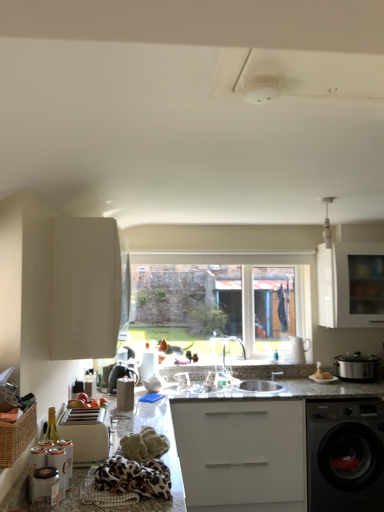
Measure the distance between point (22, 490) and camera.

Point (22, 490) is 5.00 feet away from camera.

This screenshot has height=512, width=384. Describe the element at coordinates (161, 459) in the screenshot. I see `granite countertop at lower left, the second countertop positioned from the right` at that location.

Describe the element at coordinates (88, 288) in the screenshot. I see `white glossy cabinet at upper left, the 2th cabinetry viewed from the back` at that location.

This screenshot has height=512, width=384. What do you see at coordinates (351, 285) in the screenshot?
I see `white glossy cabinet at upper right, the second cabinetry in the front-to-back sequence` at bounding box center [351, 285].

This screenshot has height=512, width=384. I want to click on white glossy countertop at lower left, the second countertop in the left-to-right sequence, so click(262, 446).

Locate an element on the screen. Image resolution: width=384 pixels, height=512 pixels. black metallic washing machine at lower right is located at coordinates (345, 455).

Find the location of a particular element. The image size is (384, 512). granite countertop at lower left, the first countertop from the left is located at coordinates (161, 459).

Is granite countertop at lower left, the second countertop positioned from the right, facing away from white matte bowl at lower right?

No.

From a real-world perspective, does granite countertop at lower left, the second countertop positioned from the right, stand above white matte bowl at lower right?

Incorrect, from a real-world perspective, granite countertop at lower left, the second countertop positioned from the right, is lower than white matte bowl at lower right.

Is granite countertop at lower left, the second countertop positioned from the right, in front of white matte bowl at lower right?

Yes, granite countertop at lower left, the second countertop positioned from the right, is closer to the viewer.

From the image's perspective, is granite countertop at lower left, the second countertop positioned from the right, beneath white matte bowl at lower right?

Yes, from the image's perspective, granite countertop at lower left, the second countertop positioned from the right, is beneath white matte bowl at lower right.

Considering the relative sizes of silver metallic tap at center and white glossy cabinet at upper right, the first cabinetry when ordered from right to left, in the image provided, is silver metallic tap at center shorter than white glossy cabinet at upper right, the first cabinetry when ordered from right to left,?

Yes.

From the image's perspective, is silver metallic tap at center located above white glossy cabinet at upper right, the second cabinetry from the left?

No, from the image's perspective, silver metallic tap at center is not above white glossy cabinet at upper right, the second cabinetry from the left.

Do you think silver metallic tap at center is within white glossy cabinet at upper right, the second cabinetry in the front-to-back sequence, or outside of it?

silver metallic tap at center is spatially situated outside white glossy cabinet at upper right, the second cabinetry in the front-to-back sequence.

Is point (134, 467) closer to viewer compared to point (331, 289)?

Yes, it is in front of point (331, 289).

Considering the relative sizes of leopard print fabric at lower left and white glossy cabinet at upper right, the second cabinetry from the left, in the image provided, is leopard print fabric at lower left thinner than white glossy cabinet at upper right, the second cabinetry from the left,?

No, leopard print fabric at lower left is not thinner than white glossy cabinet at upper right, the second cabinetry from the left.

Considering the positions of objects leopard print fabric at lower left and white glossy cabinet at upper right, the 1th cabinetry viewed from the back, in the image provided, who is more to the right, leopard print fabric at lower left or white glossy cabinet at upper right, the 1th cabinetry viewed from the back,?

white glossy cabinet at upper right, the 1th cabinetry viewed from the back, is more to the right.

Is leopard print fabric at lower left inside or outside of white glossy cabinet at upper right, the first cabinetry when ordered from right to left?

The correct answer is: outside.

Who is taller, white glossy cabinet at upper left, positioned as the 1th cabinetry in front-to-back order, or beige plastic toaster at lower left, which is counted as the second appliance, starting from the front?

white glossy cabinet at upper left, positioned as the 1th cabinetry in front-to-back order, is taller.

Where is `cabinetry on the left side of beige plastic toaster at lower left, the first appliance from the back`? The height and width of the screenshot is (512, 384). cabinetry on the left side of beige plastic toaster at lower left, the first appliance from the back is located at coordinates (88, 288).

Relative to beige plastic toaster at lower left, the first appliance from the back, is white glossy cabinet at upper left, the 2th cabinetry viewed from the back, in front or behind?

Clearly, white glossy cabinet at upper left, the 2th cabinetry viewed from the back, is behind beige plastic toaster at lower left, the first appliance from the back.

Can beige plastic toaster at lower left, which is counted as the second appliance, starting from the front, be found inside white glossy cabinet at upper left, arranged as the 1th cabinetry when viewed from the left?

No.

From a real-world perspective, is beige plastic toaster at lower left, which is counted as the second appliance, starting from the front, above or below metallic silver canister at lower left, which is the second appliance in back-to-front order?

From a real-world perspective, beige plastic toaster at lower left, which is counted as the second appliance, starting from the front, is physically above metallic silver canister at lower left, which is the second appliance in back-to-front order.

Is beige plastic toaster at lower left, which is counted as the second appliance, starting from the front, wider than metallic silver canister at lower left, which is the second appliance in back-to-front order?

Indeed, beige plastic toaster at lower left, which is counted as the second appliance, starting from the front, has a greater width compared to metallic silver canister at lower left, which is the second appliance in back-to-front order.

Is point (78, 446) positioned in front of point (65, 481)?

No, (78, 446) is behind (65, 481).

Between beige plastic toaster at lower left, which is counted as the second appliance, starting from the front, and metallic silver canister at lower left, which is the second appliance in back-to-front order, which one has less height?

Standing shorter between the two is metallic silver canister at lower left, which is the second appliance in back-to-front order.

Where is `basket above the leopard print fabric at lower left (from a real-world perspective)`? This screenshot has height=512, width=384. basket above the leopard print fabric at lower left (from a real-world perspective) is located at coordinates (17, 436).

Can you tell me how much leopard print fabric at lower left and woven brown basket at lower left differ in facing direction?

The facing directions of leopard print fabric at lower left and woven brown basket at lower left are 1.86 degrees apart.

From the image's perspective, between leopard print fabric at lower left and woven brown basket at lower left, which one is located above?

woven brown basket at lower left.

Considering the sizes of objects clear glass window at center and matte silver pot at right in the image provided, who is shorter, clear glass window at center or matte silver pot at right?

matte silver pot at right is shorter.

Measure the distance from clear glass window at center to matte silver pot at right.

clear glass window at center is 1.01 meters from matte silver pot at right.

Considering the relative positions of clear glass window at center and matte silver pot at right in the image provided, is clear glass window at center to the left of matte silver pot at right from the viewer's perspective?

Yes, clear glass window at center is to the left of matte silver pot at right.

Identify the location of countertop that is the 1st one below the white matte bowl at lower right (from a real-world perspective). (161, 459).

At what (x,y) coordinates should I click in order to perform the action: click on cabinetry on the right side of silver metallic tap at center. Please return your answer as a coordinate pair (x, y). The image size is (384, 512). Looking at the image, I should click on (351, 285).

When comparing their distances from white matte bowl at lower right, does leopard print fabric at lower left or matte silver pot at right seem closer?

The object closer to white matte bowl at lower right is matte silver pot at right.

From the picture: Estimate the real-world distances between objects in this image. Which object is closer to white glossy cabinet at upper right, the 1th cabinetry viewed from the back, white matte bowl at lower right or black metallic washing machine at lower right?

white matte bowl at lower right.

From the image, which object appears to be farther from beige plastic toaster at lower left, which is counted as the second appliance, starting from the front, metallic silver canister at lower left, which is counted as the 1th appliance, starting from the front, or white glossy countertop at lower left, the second countertop in the left-to-right sequence?

Based on the image, white glossy countertop at lower left, the second countertop in the left-to-right sequence, appears to be further to beige plastic toaster at lower left, which is counted as the second appliance, starting from the front.

Considering their positions, is white matte bowl at lower right positioned closer to silver metallic tap at center than white glossy cabinet at upper right, the first cabinetry when ordered from right to left?

white matte bowl at lower right.

Looking at the image, which one is located closer to granite countertop at lower left, the first countertop from the left, clear glass window at center or white glossy countertop at lower left, the second countertop in the left-to-right sequence?

The object closer to granite countertop at lower left, the first countertop from the left, is white glossy countertop at lower left, the second countertop in the left-to-right sequence.

From the image, which object appears to be nearer to black metallic washing machine at lower right, silver metallic tap at center or leopard print fabric at lower left?

Based on the image, silver metallic tap at center appears to be nearer to black metallic washing machine at lower right.

Based on their spatial positions, is beige plastic toaster at lower left, which is counted as the second appliance, starting from the front, or matte silver pot at right further from woven brown basket at lower left?

Based on the image, matte silver pot at right appears to be further to woven brown basket at lower left.

Considering their positions, is granite countertop at lower left, the second countertop positioned from the right, positioned closer to white matte bowl at lower right than white glossy cabinet at upper left, the second cabinetry viewed from the right?

granite countertop at lower left, the second countertop positioned from the right, is closer to white matte bowl at lower right.

Locate an element on the screen. This screenshot has width=384, height=512. kitchen appliance between metallic silver canister at lower left, which is the second appliance in back-to-front order, and clear glass window at center in the front-back direction is located at coordinates (357, 367).

The height and width of the screenshot is (512, 384). I want to click on tap between beige plastic toaster at lower left, which is counted as the second appliance, starting from the front, and matte silver pot at right, in the horizontal direction, so click(x=225, y=348).

At what (x,y) coordinates should I click in order to perform the action: click on material between metallic silver canister at lower left, which is the second appliance in back-to-front order, and white glossy countertop at lower left, the 1th countertop when ordered from right to left, vertically. Please return your answer as a coordinate pair (x, y). This screenshot has width=384, height=512. Looking at the image, I should click on (129, 475).

Find the location of a particular element. The height and width of the screenshot is (512, 384). appliance between leopard print fabric at lower left and white matte bowl at lower right from front to back is located at coordinates (86, 433).